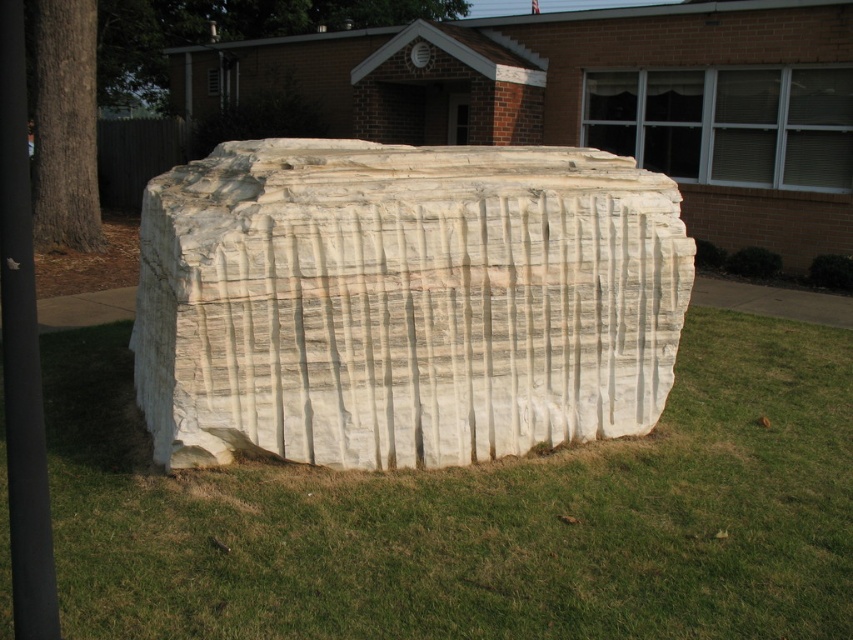
You are a landscape architect planning to install a new garden path. You need to know the relative positions of the white marble rock at center and the black plastic pole at left to ensure proper placement. Which object is positioned further back in the scene?

The black plastic pole at left is positioned further back than the white marble rock at center, as it is behind it.

You are standing in front of the sculpture and want to place a small potted plant on the ground. The potted plant needs to be placed on the green grass at lower center. Is the white marble rock at center in the way of placing the plant there?

The green grass at lower center is below the white marble rock at center, so the rock is blocking access to the grass. You cannot place the potted plant there without moving the rock.

Consider the image. You are standing in front of the stone sculpture and want to know which of the two points, point [730,316] or point [248,376], is closer to you. Can you determine this based on their positions?

Point [248,376] is closer to you because it is positioned closer to the camera than point [730,316].